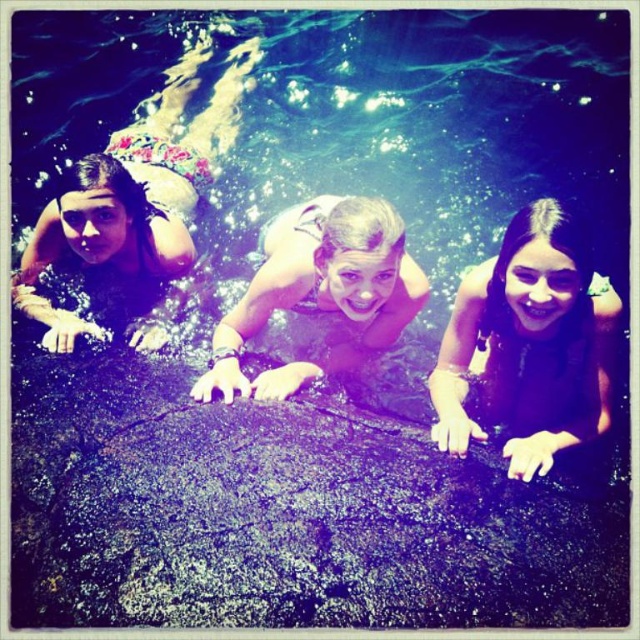
Question: Can you confirm if floral swimsuit at left is wider than smooth skin girl at center?

Choices:
 (A) no
 (B) yes

Answer: (B)

Question: Among these points, which one is farthest from the camera?

Choices:
 (A) (280, 400)
 (B) (461, 326)

Answer: (B)

Question: From the image, what is the correct spatial relationship of black matte hair at center in relation to smooth skin girl at center?

Choices:
 (A) right
 (B) left

Answer: (A)

Question: Does black matte hair at center appear on the left side of smooth skin girl at center?

Choices:
 (A) yes
 (B) no

Answer: (B)

Question: Which of the following is the closest to the observer?

Choices:
 (A) (244, 56)
 (B) (374, 340)
 (C) (566, 403)

Answer: (C)

Question: Which object is positioned farthest from the black matte hair at center?

Choices:
 (A) smooth skin girl at center
 (B) floral swimsuit at left

Answer: (B)